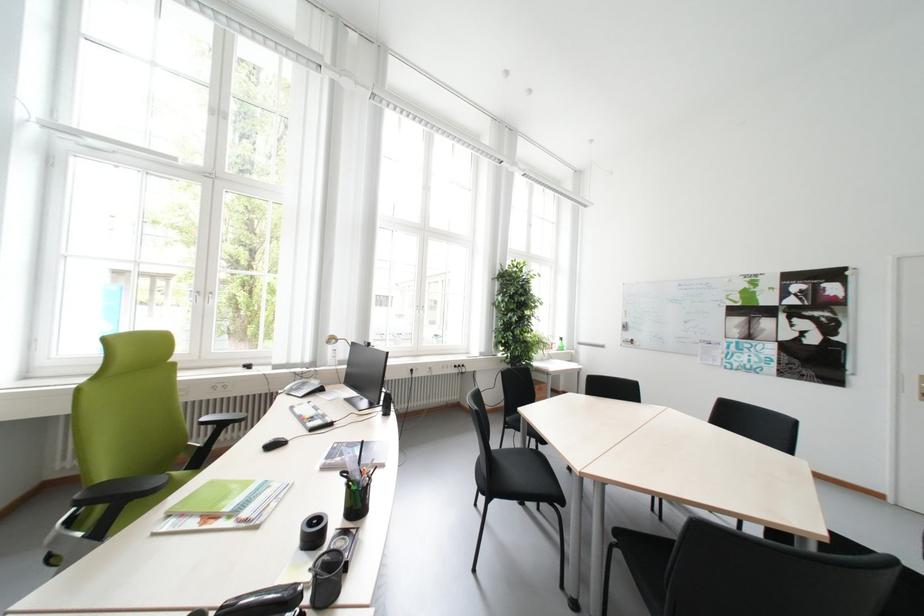
What do you see at coordinates (201, 297) in the screenshot? The image size is (924, 616). I see `the white window handle` at bounding box center [201, 297].